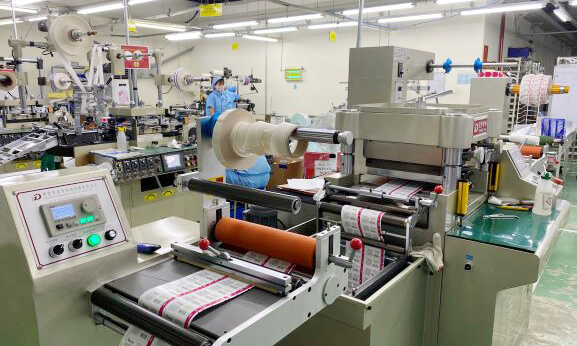
At what (x,y) coordinates should I click in order to perform the action: click on red knob. Please return your answer as a coordinate pair (x, y). This screenshot has width=577, height=346. Looking at the image, I should click on (359, 248), (440, 193).